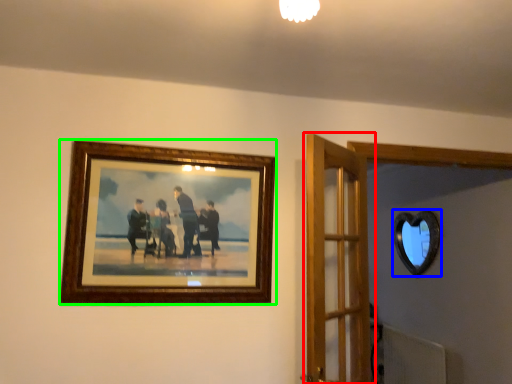
Question: Considering the real-world distances, which object is farthest from door (highlighted by a red box)? mirror (highlighted by a blue box) or picture frame (highlighted by a green box)?

Choices:
 (A) mirror
 (B) picture frame

Answer: (A)